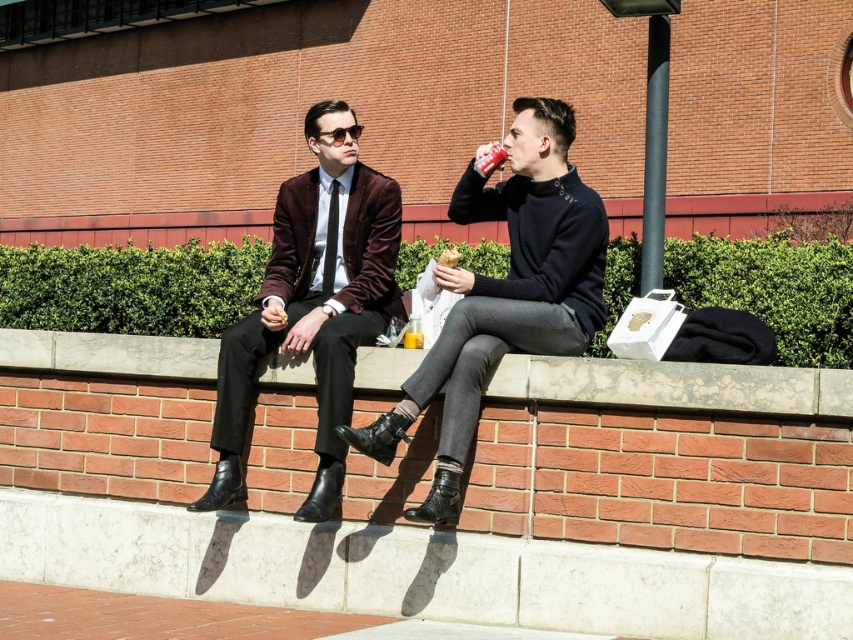
Is point (334, 488) positioned after point (566, 362)?

Yes, it is.

Measure the distance from velvet burgundy blazer at center to smooth concrete ledge at center.

velvet burgundy blazer at center is 1.10 meters from smooth concrete ledge at center.

Where is `velvet burgundy blazer at center`? Image resolution: width=853 pixels, height=640 pixels. velvet burgundy blazer at center is located at coordinates (312, 301).

Does matte black sweater at center have a larger size compared to smooth concrete ledge at center?

Indeed, matte black sweater at center has a larger size compared to smooth concrete ledge at center.

Image resolution: width=853 pixels, height=640 pixels. Describe the element at coordinates (503, 292) in the screenshot. I see `matte black sweater at center` at that location.

Is point (477, 312) positioned before point (152, 339)?

Yes, point (477, 312) is in front of point (152, 339).

Locate an element on the screen. Image resolution: width=853 pixels, height=640 pixels. matte black sweater at center is located at coordinates (503, 292).

Can you confirm if matte black sweater at center is positioned above velvet burgundy blazer at center?

Indeed, matte black sweater at center is positioned over velvet burgundy blazer at center.

Is matte black sweater at center positioned before velvet burgundy blazer at center?

Yes, it is.

What are the coordinates of `matte black sweater at center` in the screenshot? It's located at click(x=503, y=292).